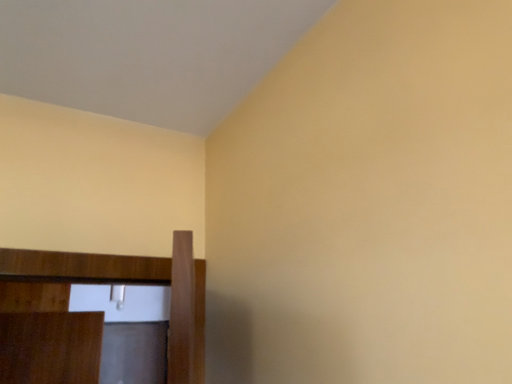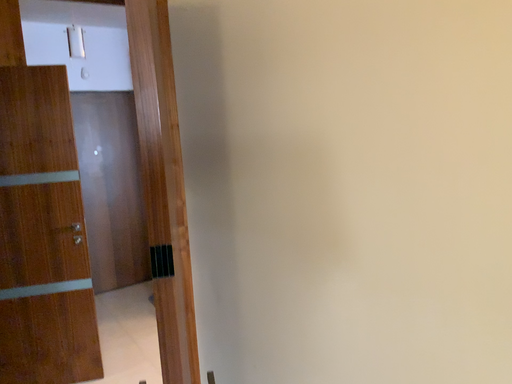
Question: How did the camera likely rotate when shooting the video?

Choices:
 (A) rotated upward
 (B) rotated downward

Answer: (B)